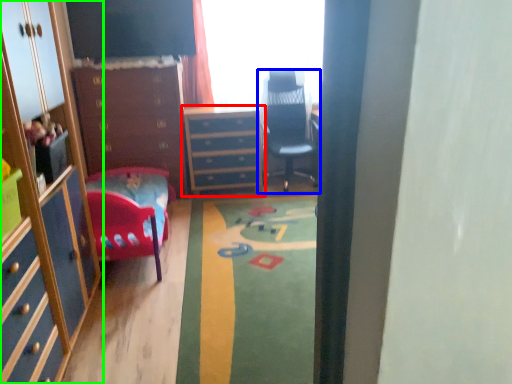
Question: Which object is the closest to the chest of drawers (highlighted by a red box)? Choose among these: chair (highlighted by a blue box) or cabinetry (highlighted by a green box).

Choices:
 (A) chair
 (B) cabinetry

Answer: (A)